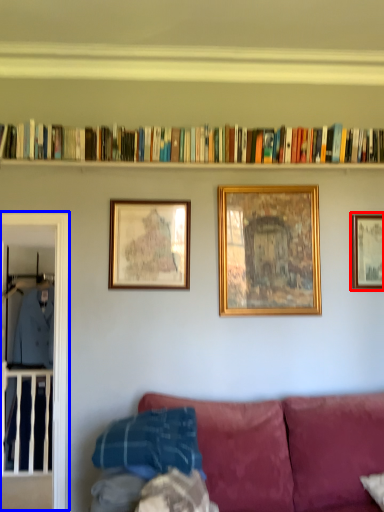
Question: Among these objects, which one is nearest to the camera, picture frame (highlighted by a red box) or glass door (highlighted by a blue box)?

Choices:
 (A) picture frame
 (B) glass door

Answer: (B)